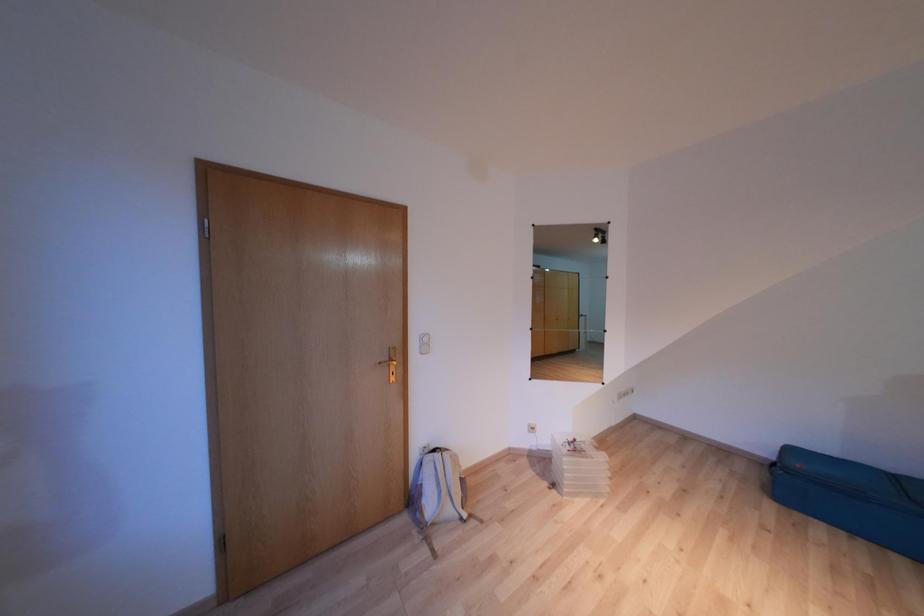
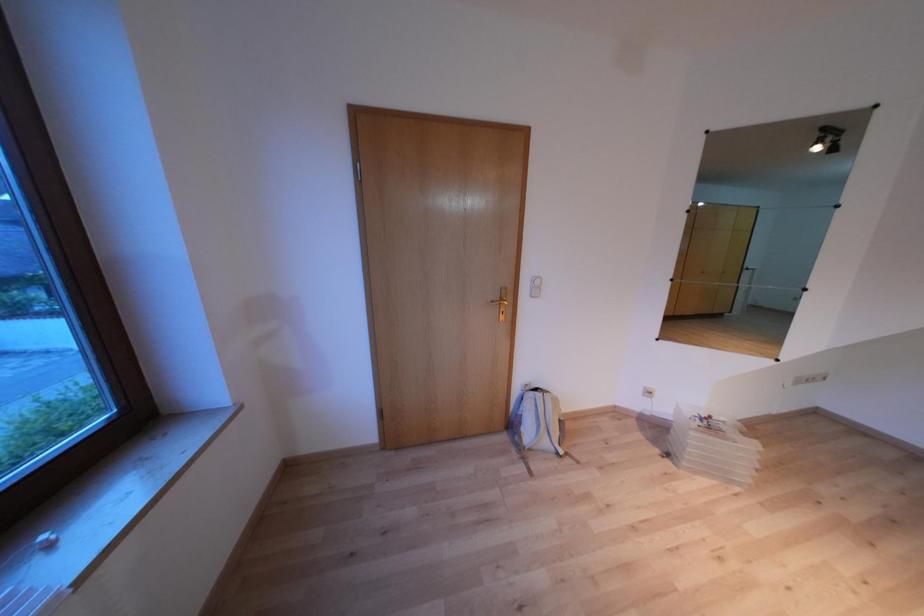
Question: The images are taken continuously from a first-person perspective. In which direction are you moving?

Choices:
 (A) Left
 (B) Right
 (C) Forward
 (D) Backward

Answer: (A)